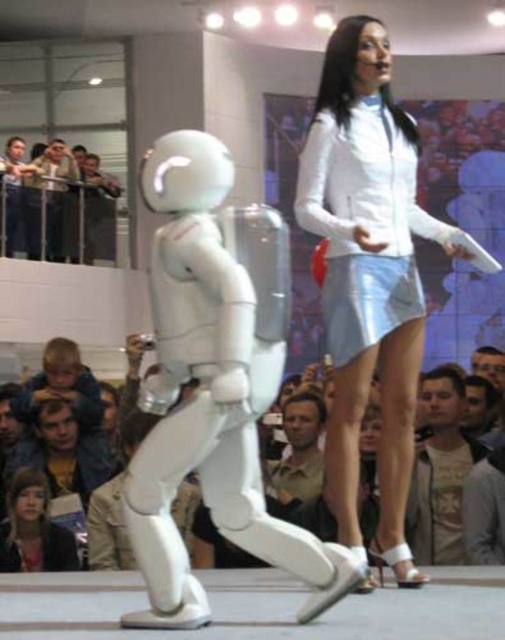
You are a fashion designer observing the scene. The runway is divided into sections marked with coordinates. The robot is at position 0.428, 0.729. Can you determine if the white leather skirt at upper right is positioned to the right of the robot?

The white leather skirt at upper right is located at point [368,273], which is the same position as the robot. Therefore, it is not positioned to the right of the robot.

You are standing at the runway entrance and want to take a photo of the point at coordinates point (117, 518). If your camera has a maximum focus range of 20 meters, will you be able to focus on that point?

The distance of point (117, 518) from viewer is 18.75 meters, which is within the camera maximum focus range of 20 meters. Yes, you can focus on that point.